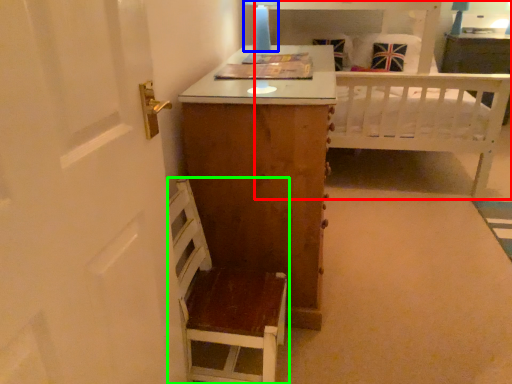
Question: Which object is positioned farthest from bed (highlighted by a red box)? Select from table lamp (highlighted by a blue box) and furniture (highlighted by a green box).

Choices:
 (A) table lamp
 (B) furniture

Answer: (B)